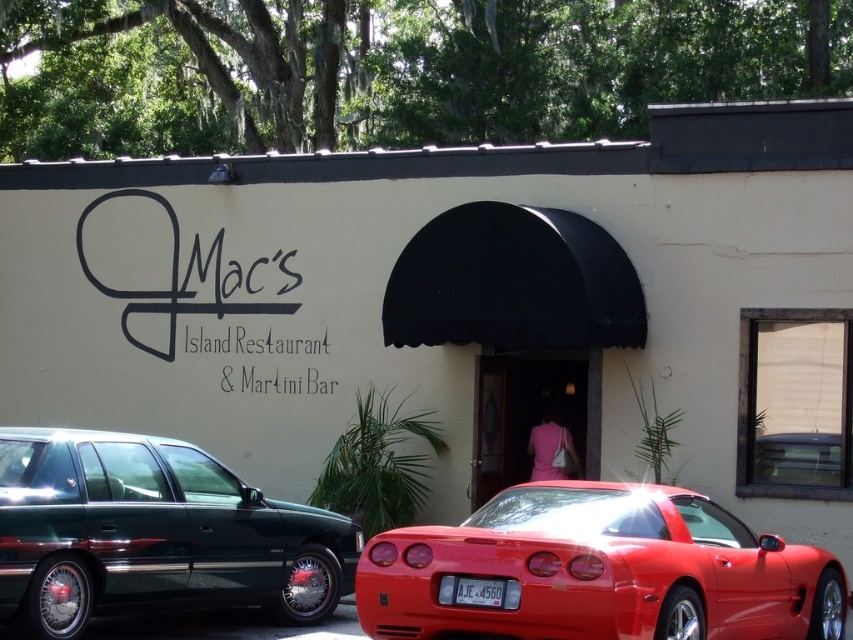
Which is above, shiny red sports car at lower right or shiny dark green sedan at left?

shiny red sports car at lower right is higher up.

Image resolution: width=853 pixels, height=640 pixels. Describe the element at coordinates (601, 572) in the screenshot. I see `shiny red sports car at lower right` at that location.

Is point (698, 499) positioned behind point (292, 566)?

No, (698, 499) is in front of (292, 566).

The height and width of the screenshot is (640, 853). In order to click on shiny red sports car at lower right in this screenshot , I will do `click(601, 572)`.

Who is positioned more to the left, shiny dark green sedan at left or white plastic license plate at center?

From the viewer's perspective, shiny dark green sedan at left appears more on the left side.

Can you confirm if shiny dark green sedan at left is shorter than white plastic license plate at center?

Incorrect, shiny dark green sedan at left's height does not fall short of white plastic license plate at center's.

The width and height of the screenshot is (853, 640). In order to click on shiny dark green sedan at left in this screenshot , I will do `click(154, 534)`.

Is shiny red sports car at lower right above white plastic license plate at center?

Incorrect, shiny red sports car at lower right is not positioned above white plastic license plate at center.

Where is `shiny red sports car at lower right`? The image size is (853, 640). shiny red sports car at lower right is located at coordinates (601, 572).

You are a GUI agent. You are given a task and a screenshot of the screen. Output one action in this format:
    pyautogui.click(x=<x>, y=<y>)
    Task: Click on the shiny red sports car at lower right
    This screenshot has width=853, height=640.
    Given the screenshot: What is the action you would take?
    pyautogui.click(x=601, y=572)